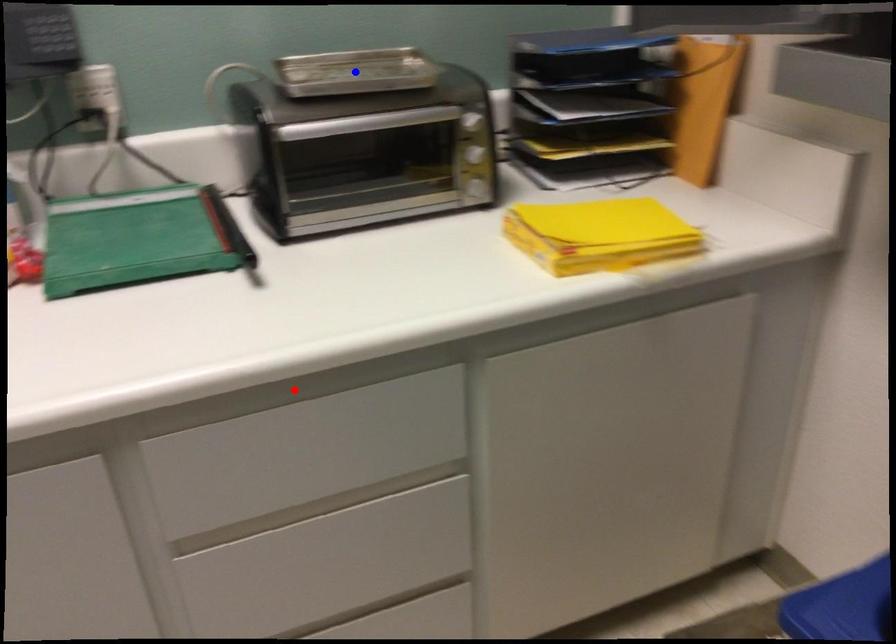
Question: Two points are marked on the image. Which point is closer to the camera?

Choices:
 (A) Blue point is closer.
 (B) Red point is closer.

Answer: (B)